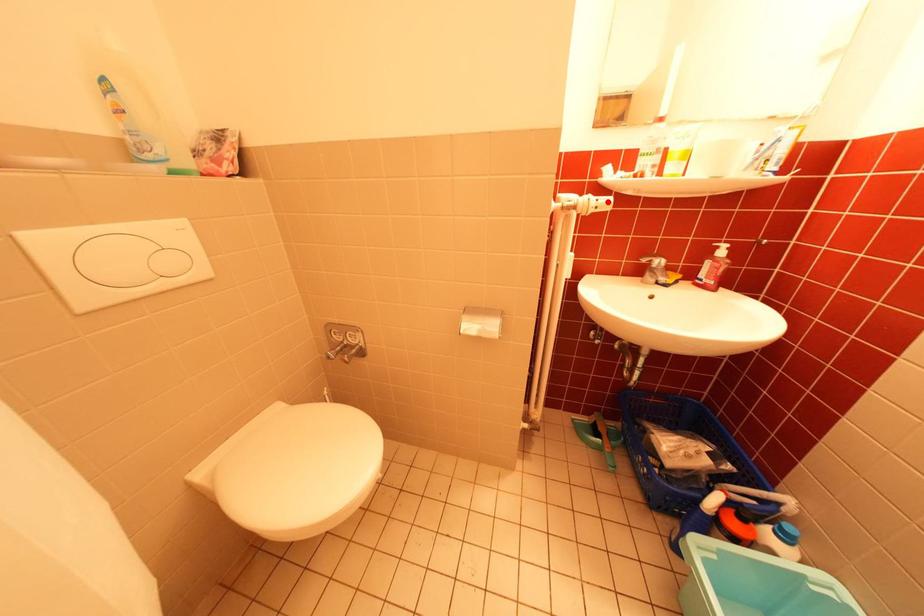
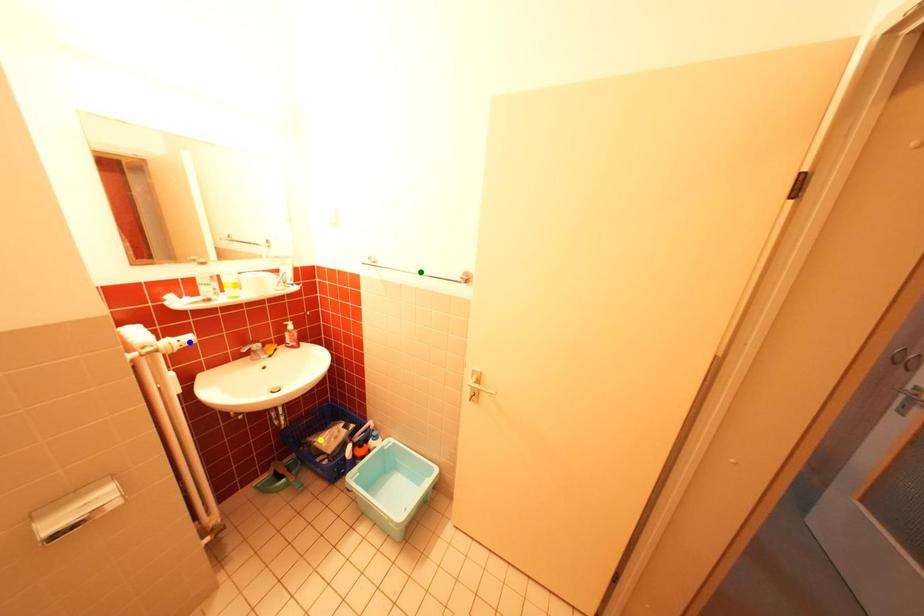
Question: I am providing you with two images of the same scene from different viewpoints. A red point is marked on the first image. You are given multiple points on the second image. Can you choose the point in image 2 that corresponds to the point in image 1?

Choices:
 (A) yellow point
 (B) blue point
 (C) green point

Answer: (B)